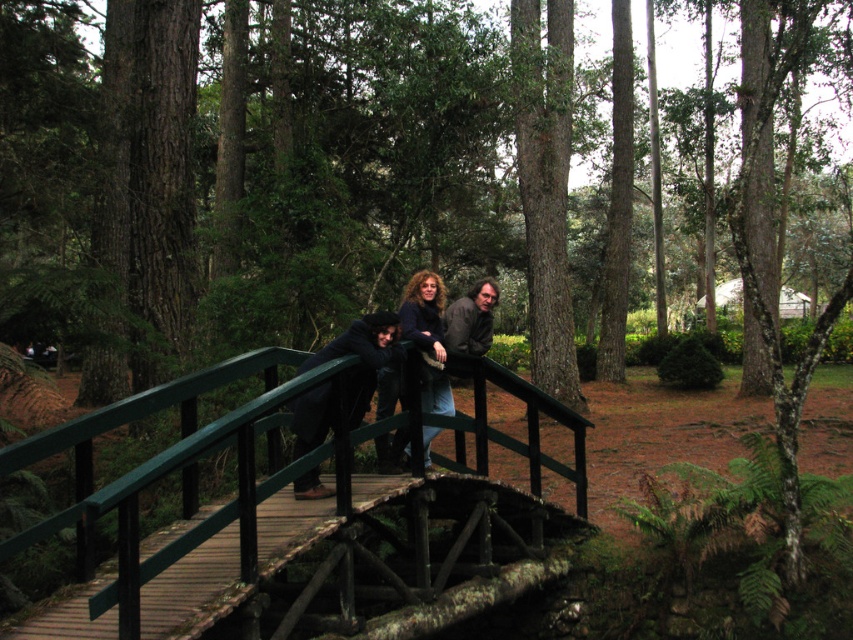
Looking at this image, you are standing on the wooden bridge in the forest scene. There are two points marked on the bridge. The first point is at coordinates point (463, 339) and the second point is at point (434, 276). If you want to move closer to the viewer, which point should you walk towards?

You should walk towards point (463, 339) because it is closer to the viewer than point (434, 276) according to the scene description.